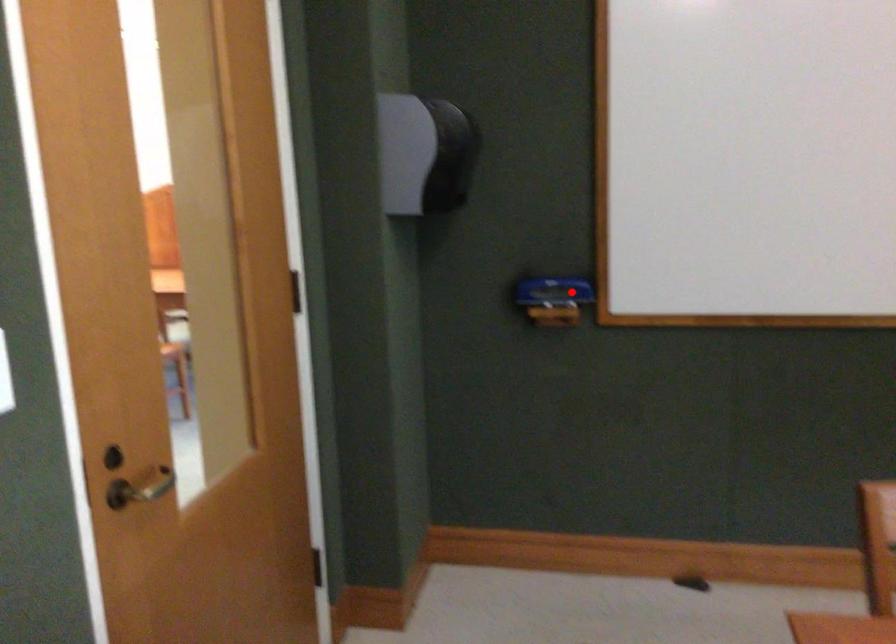
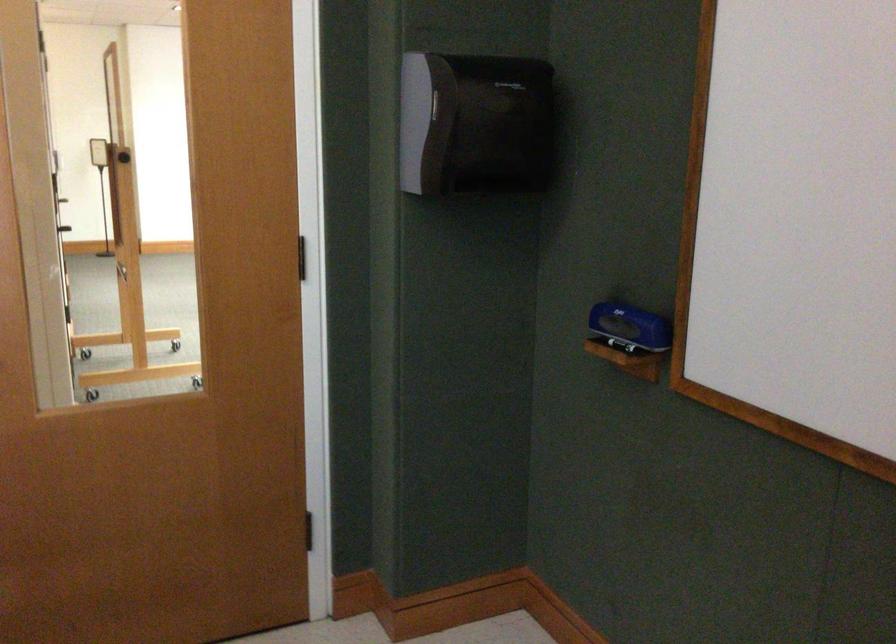
Question: I am providing you with two images of the same scene from different viewpoints. Given a red point in image1, look at the same physical point in image2. Is it:

Choices:
 (A) Closer to the viewpoint
 (B) Farther from the viewpoint

Answer: (A)